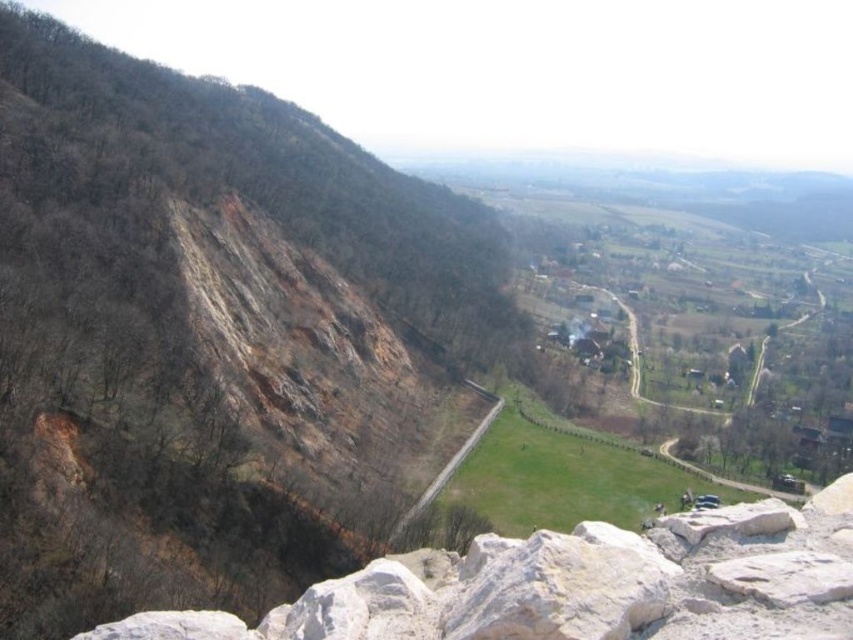
Between point (741, 588) and point (421, 509), which one is positioned behind?

The point (421, 509) is behind.

This screenshot has width=853, height=640. What do you see at coordinates (579, 586) in the screenshot?
I see `white rough rock at lower left` at bounding box center [579, 586].

Locate an element on the screen. white rough rock at lower left is located at coordinates (579, 586).

You are a GUI agent. You are given a task and a screenshot of the screen. Output one action in this format:
    pyautogui.click(x=<x>, y=<y>)
    Task: Click on the white rough rock at lower left
    Image resolution: width=853 pixels, height=640 pixels.
    Given the screenshot: What is the action you would take?
    pyautogui.click(x=579, y=586)